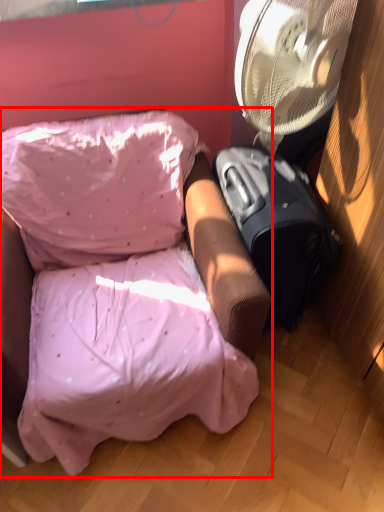
Question: From the image's perspective, where is furniture (annotated by the red box) located relative to luggage?

Choices:
 (A) above
 (B) below

Answer: (B)